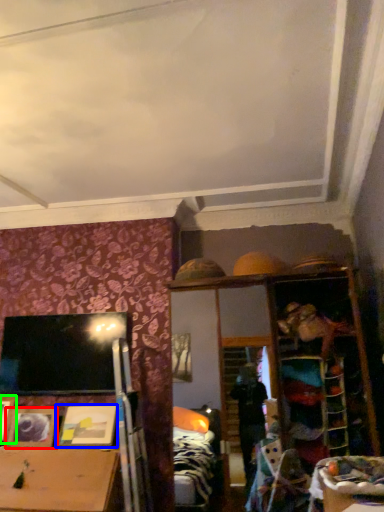
Question: Which object is the farthest from picture frame (highlighted by a red box)? Choose among these: picture frame (highlighted by a blue box) or picture frame (highlighted by a green box).

Choices:
 (A) picture frame
 (B) picture frame

Answer: (A)